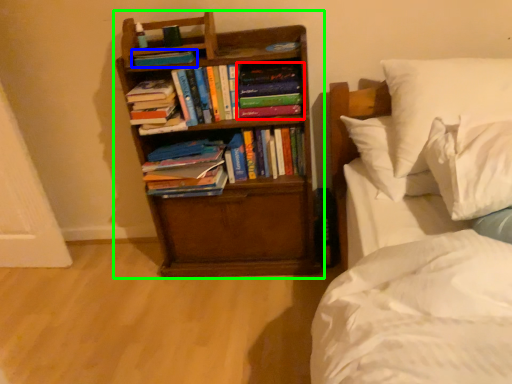
Question: Which object is positioned farthest from book (highlighted by a red box)? Select from book (highlighted by a blue box) and bookcase (highlighted by a green box).

Choices:
 (A) book
 (B) bookcase

Answer: (A)